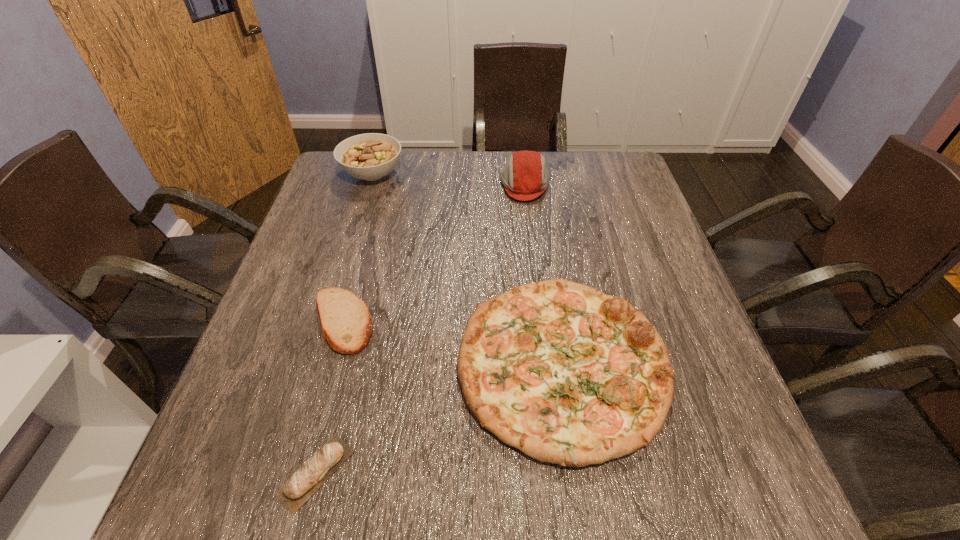
The image size is (960, 540). Find the location of `free space between the farther pita bread and the stew`. free space between the farther pita bread and the stew is located at coordinates (358, 248).

Identify the location of free space between the nearer pita bread and the cap. Image resolution: width=960 pixels, height=540 pixels. (420, 328).

What are the coordinates of `vacant area that lies between the cap and the nearer pita bread` in the screenshot? It's located at (420, 328).

I want to click on unoccupied area between the farther pita bread and the third tallest object, so click(453, 343).

At what (x,y) coordinates should I click in order to perform the action: click on vacant area that lies between the farther pita bread and the cap. Please return your answer as a coordinate pair (x, y). Image resolution: width=960 pixels, height=540 pixels. Looking at the image, I should click on (434, 253).

Image resolution: width=960 pixels, height=540 pixels. I want to click on vacant point located between the farther pita bread and the third shortest object, so click(453, 343).

Choose which object is the nearest neighbor to the nearer pita bread. Please provide its 2D coordinates. Your answer should be formatted as a tuple, i.e. [(x, y)], where the tuple contains the x and y coordinates of a point satisfying the conditions above.

[(346, 323)]

Identify which object is located as the fourth nearest to the pizza. Please provide its 2D coordinates. Your answer should be formatted as a tuple, i.e. [(x, y)], where the tuple contains the x and y coordinates of a point satisfying the conditions above.

[(371, 156)]

Identify the location of free point that satisfies the following two spatial constraints: 1. on the front-facing side of the pizza; 2. on the right side of the cap. The image size is (960, 540). (546, 366).

At what (x,y) coordinates should I click in order to perform the action: click on vacant space that satisfies the following two spatial constraints: 1. on the front side of the third tallest object; 2. on the right side of the farther pita bread. Please return your answer as a coordinate pair (x, y). Looking at the image, I should click on (331, 366).